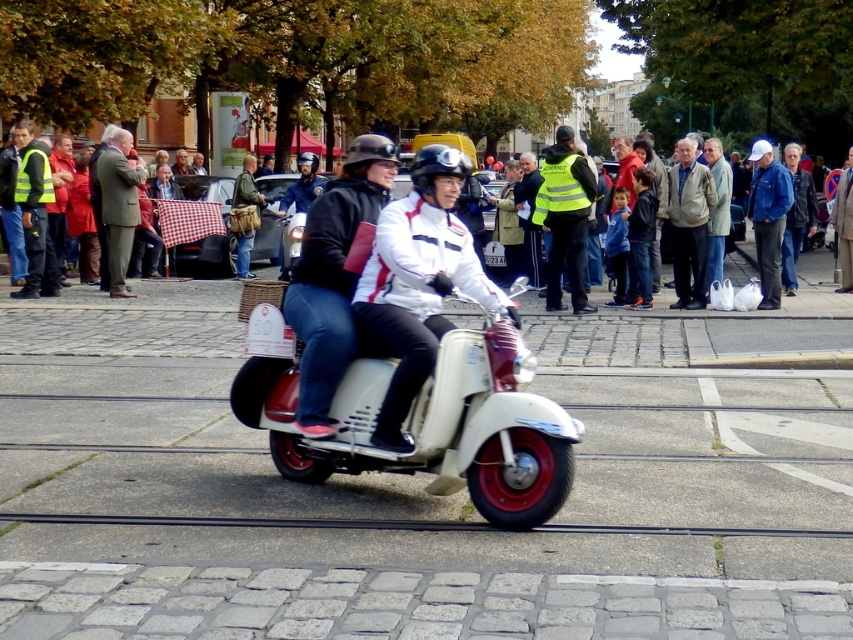
You are a photographer trying to capture a clear shot of both the white matte jacket at center and the light gray jacket at center. Based on their positions, which jacket should you focus on first to ensure both are in frame?

The white matte jacket at center is located below the light gray jacket at center, so you should focus on the light gray jacket at center first to ensure both are in frame.

You are a photographer standing on the sidewalk, trying to capture a photo of both the white matte jacket at center and the light gray jacket at center. Which jacket will appear larger in the photo?

The white matte jacket at center will appear larger in the photo because it is closer to the viewer than the light gray jacket at center.